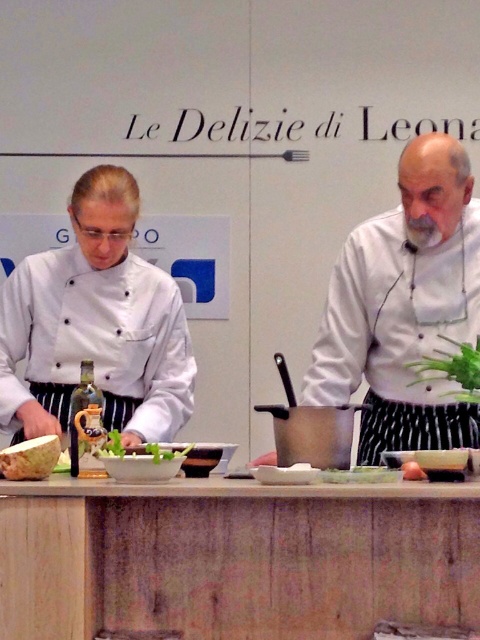
Question: Estimate the real-world distances between objects in this image. Which object is farther from the white matte chef coat at left?

Choices:
 (A) white chef coat at right
 (B) white chef coat at center
 (C) light brown wooden cutting board at lower left

Answer: (A)

Question: Is white matte chef coat at left behind light brown wooden cutting board at lower left?

Choices:
 (A) yes
 (B) no

Answer: (A)

Question: Which point is farther from the camera taking this photo?

Choices:
 (A) (376, 260)
 (B) (432, 273)
 (C) (462, 570)
 (D) (416, 468)

Answer: (A)

Question: Can you confirm if wooden at center is positioned below white matte chef coat at left?

Choices:
 (A) yes
 (B) no

Answer: (A)

Question: Among these objects, which one is farthest from the camera?

Choices:
 (A) wooden at center
 (B) white chef coat at right
 (C) white matte chef coat at left
 (D) white chef coat at center

Answer: (C)

Question: Does white chef coat at center have a lesser width compared to light brown wooden cutting board at lower left?

Choices:
 (A) no
 (B) yes

Answer: (A)